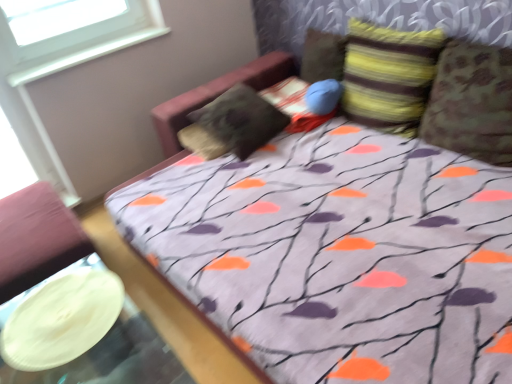
The height and width of the screenshot is (384, 512). Find the location of `empty space that is ontop of white glossy platter at lower left (from a real-world perspective)`. empty space that is ontop of white glossy platter at lower left (from a real-world perspective) is located at coordinates pyautogui.click(x=58, y=311).